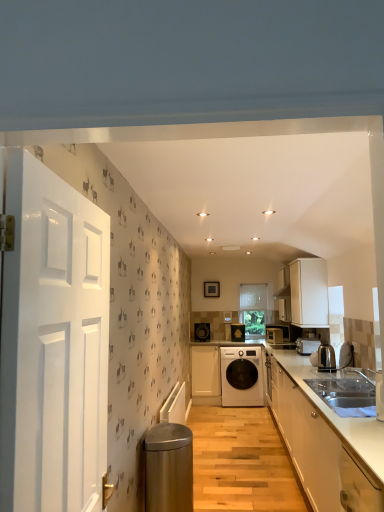
Describe the element at coordinates (347, 392) in the screenshot. The width and height of the screenshot is (384, 512). I see `stainless steel sink at lower right` at that location.

Find the location of a particular element. white glossy cabinets at lower right, which is the 2th cabinetry from right to left is located at coordinates (320, 451).

This screenshot has width=384, height=512. Describe the element at coordinates (309, 291) in the screenshot. I see `white matte cabinet at upper right, the 1th cabinetry when ordered from right to left` at that location.

Image resolution: width=384 pixels, height=512 pixels. Describe the element at coordinates (307, 345) in the screenshot. I see `metallic silver toaster at lower right, which is the second kitchen appliance from front to back` at that location.

Describe the element at coordinates (53, 343) in the screenshot. This screenshot has height=512, width=384. I see `white glossy door at left` at that location.

This screenshot has height=512, width=384. Identify the location of white matte cabinet at center, placed as the 1th cabinetry when sorted from left to right. (205, 371).

I want to click on the 3rd appliance positioned above the matte black microwave at center, marked as the third kitchen appliance in a front-to-back arrangement (from the image's perspective), so click(202, 332).

Considering the positions of objects matte black microwave at center, the first kitchen appliance from the back, and matte black speaker at center, arranged as the third appliance when viewed from the right, in the image provided, who is more to the right, matte black microwave at center, the first kitchen appliance from the back, or matte black speaker at center, arranged as the third appliance when viewed from the right,?

matte black microwave at center, the first kitchen appliance from the back, is more to the right.

Would you say matte black speaker at center, arranged as the third appliance when viewed from the right, is part of matte black microwave at center, the first kitchen appliance from the back,'s contents?

No, matte black speaker at center, arranged as the third appliance when viewed from the right, is not a part of matte black microwave at center, the first kitchen appliance from the back.

Can you tell me how much matte black microwave at center, the first kitchen appliance from the back, and matte black speaker at center, the first appliance when ordered from left to right, differ in facing direction?

matte black microwave at center, the first kitchen appliance from the back, and matte black speaker at center, the first appliance when ordered from left to right, are facing 56 degrees away from each other.

In the scene shown: Considering the relative positions of matte black speaker at center, arranged as the third appliance when viewed from the right, and white fabric at center in the image provided, is matte black speaker at center, arranged as the third appliance when viewed from the right, to the right of white fabric at center from the viewer's perspective?

Incorrect, matte black speaker at center, arranged as the third appliance when viewed from the right, is not on the right side of white fabric at center.

Considering the points (197, 327) and (258, 296), which point is behind, point (197, 327) or point (258, 296)?

The point (258, 296) is farther from the camera.

Locate an element on the screen. The image size is (384, 512). window screen behind the matte black speaker at center, arranged as the third appliance when viewed from the right is located at coordinates (253, 309).

Is point (243, 328) positioned in front of point (355, 411)?

No, it is not.

Which is more to the right, white glossy washing machine at center, the second appliance positioned from the left, or stainless steel sink at lower right?

stainless steel sink at lower right.

From a real-world perspective, is white glossy washing machine at center, arranged as the second appliance when viewed from the right, positioned above or below stainless steel sink at lower right?

white glossy washing machine at center, arranged as the second appliance when viewed from the right, is above stainless steel sink at lower right.

Considering the sizes of objects white fabric at center and stainless steel water heater at lower left in the image provided, who is bigger, white fabric at center or stainless steel water heater at lower left?

stainless steel water heater at lower left.

Which of these two, white fabric at center or stainless steel water heater at lower left, is wider?

stainless steel water heater at lower left.

From the picture: From the image's perspective, would you say white fabric at center is positioned over stainless steel water heater at lower left?

Yes, from the image's perspective, white fabric at center is above stainless steel water heater at lower left.

Considering the positions of point (265, 286) and point (192, 478), is point (265, 286) closer or farther from the camera than point (192, 478)?

Point (265, 286) is positioned farther from the camera compared to point (192, 478).

Considering the relative positions of white matte cabinet at upper right, the 1th cabinetry when ordered from right to left, and white glossy washing machine at center, arranged as the second appliance when viewed from the right, in the image provided, is white matte cabinet at upper right, the 1th cabinetry when ordered from right to left, in front of white glossy washing machine at center, arranged as the second appliance when viewed from the right,?

Yes, white matte cabinet at upper right, the 1th cabinetry when ordered from right to left, is in front of white glossy washing machine at center, arranged as the second appliance when viewed from the right.

Considering the sizes of objects white matte cabinet at upper right, marked as the 2th cabinetry in a front-to-back arrangement, and white glossy washing machine at center, the second appliance positioned from the left, in the image provided, who is bigger, white matte cabinet at upper right, marked as the 2th cabinetry in a front-to-back arrangement, or white glossy washing machine at center, the second appliance positioned from the left,?

white matte cabinet at upper right, marked as the 2th cabinetry in a front-to-back arrangement, is bigger.

From the image's perspective, which is above, white matte cabinet at upper right, arranged as the second cabinetry when viewed from the back, or white glossy washing machine at center, arranged as the second appliance when viewed from the right?

From the image's view, white matte cabinet at upper right, arranged as the second cabinetry when viewed from the back, is above.

What are the coordinates of `cabinetry above the white glossy washing machine at center, arranged as the second appliance when viewed from the right (from a real-world perspective)` in the screenshot? It's located at (309, 291).

Considering the relative sizes of white glossy washing machine at center and matte black microwave at center, marked as the third kitchen appliance in a front-to-back arrangement, in the image provided, is white glossy washing machine at center thinner than matte black microwave at center, marked as the third kitchen appliance in a front-to-back arrangement,?

Incorrect, the width of white glossy washing machine at center is not less than that of matte black microwave at center, marked as the third kitchen appliance in a front-to-back arrangement.

Where is `home appliance lying on the left of matte black microwave at center, the first kitchen appliance from the back`? The height and width of the screenshot is (512, 384). home appliance lying on the left of matte black microwave at center, the first kitchen appliance from the back is located at coordinates (242, 376).

How different are the orientations of white glossy washing machine at center and matte black microwave at center, marked as the third kitchen appliance in a front-to-back arrangement, in degrees?

43.4 degrees.

Is white glossy washing machine at center oriented away from matte black microwave at center, marked as the third kitchen appliance in a front-to-back arrangement?

white glossy washing machine at center does not have its back to matte black microwave at center, marked as the third kitchen appliance in a front-to-back arrangement.

Between white glossy cabinets at lower right, which is the 3th cabinetry in back-to-front order, and metallic silver microwave at center, which is the third appliance in left-to-right order, which one has smaller size?

metallic silver microwave at center, which is the third appliance in left-to-right order, is smaller.

Which of these two, white glossy cabinets at lower right, which is counted as the first cabinetry, starting from the front, or metallic silver microwave at center, which ranks as the first appliance in right-to-left order, stands shorter?

Standing shorter between the two is metallic silver microwave at center, which ranks as the first appliance in right-to-left order.

Where is `the 1st cabinetry below the metallic silver microwave at center, which is the third appliance in left-to-right order (from the image's perspective)`? the 1st cabinetry below the metallic silver microwave at center, which is the third appliance in left-to-right order (from the image's perspective) is located at coordinates (320, 451).

Measure the distance from white glossy cabinets at lower right, which is counted as the first cabinetry, starting from the front, to metallic silver microwave at center, which ranks as the first appliance in right-to-left order.

7.91 feet.

Starting from the matte black microwave at center, the first kitchen appliance from the back, which appliance is the 1st one behind? Please provide its 2D coordinates.

[(202, 332)]

What are the coordinates of `appliance that is the 1st one when counting downward from the white fabric at center (from the image's perspective)` in the screenshot? It's located at (202, 332).

Estimate the real-world distances between objects in this image. Which object is further from matte black microwave at center, the first kitchen appliance from the back, white fabric at center or shiny metallic kettle at right, the 3th kitchen appliance from the back?

The object further to matte black microwave at center, the first kitchen appliance from the back, is shiny metallic kettle at right, the 3th kitchen appliance from the back.

Which object lies nearer to the anchor point metallic silver microwave at center, which ranks as the first appliance in right-to-left order, metallic silver toaster at lower right, which is the 2th kitchen appliance in back-to-front order, or matte black microwave at center, the first kitchen appliance from the back?

matte black microwave at center, the first kitchen appliance from the back, lies closer to metallic silver microwave at center, which ranks as the first appliance in right-to-left order, than the other object.

Looking at the image, which one is located closer to metallic silver microwave at center, which ranks as the first appliance in right-to-left order, shiny metallic kettle at right, the 3th kitchen appliance from the back, or white glossy door at left?

Based on the image, shiny metallic kettle at right, the 3th kitchen appliance from the back, appears to be nearer to metallic silver microwave at center, which ranks as the first appliance in right-to-left order.

Estimate the real-world distances between objects in this image. Which object is closer to white matte cabinet at upper right, marked as the 2th cabinetry in a front-to-back arrangement, matte black speaker at center, arranged as the third appliance when viewed from the right, or matte black microwave at center, the first kitchen appliance from the back?

matte black microwave at center, the first kitchen appliance from the back, is closer to white matte cabinet at upper right, marked as the 2th cabinetry in a front-to-back arrangement.

Which object lies further to the anchor point white glossy washing machine at center, the second appliance positioned from the left, matte black speaker at center, the first appliance when ordered from left to right, or stainless steel sink at lower right?

stainless steel sink at lower right lies further to white glossy washing machine at center, the second appliance positioned from the left, than the other object.

Considering their positions, is metallic silver microwave at center, which ranks as the first appliance in right-to-left order, positioned closer to stainless steel water heater at lower left than white glossy washing machine at center, arranged as the second appliance when viewed from the right?

metallic silver microwave at center, which ranks as the first appliance in right-to-left order, is positioned closer to the anchor stainless steel water heater at lower left.

Considering their positions, is matte black speaker at center, the first appliance when ordered from left to right, positioned closer to white glossy washing machine at center than white matte cabinet at upper right, arranged as the second cabinetry when viewed from the back?

matte black speaker at center, the first appliance when ordered from left to right, is positioned closer to the anchor white glossy washing machine at center.

From the image, which object appears to be farther from white glossy cabinets at lower right, which is the 3th cabinetry in back-to-front order, white matte cabinet at center, marked as the third cabinetry in a right-to-left arrangement, or white matte cabinet at upper right, the 3th cabinetry viewed from the left?

white matte cabinet at center, marked as the third cabinetry in a right-to-left arrangement, is further to white glossy cabinets at lower right, which is the 3th cabinetry in back-to-front order.

Locate an element on the screen. Image resolution: width=384 pixels, height=512 pixels. sink between stainless steel water heater at lower left and shiny metallic kettle at right, the first kitchen appliance when ordered from front to back, from left to right is located at coordinates (347, 392).

Locate an element on the screen. The image size is (384, 512). water heater between white glossy cabinets at lower right, acting as the second cabinetry starting from the left, and matte black speaker at center, arranged as the third appliance when viewed from the right, from front to back is located at coordinates (169, 468).

The height and width of the screenshot is (512, 384). I want to click on cabinetry located between white glossy cabinets at lower right, acting as the second cabinetry starting from the left, and metallic silver microwave at center, which ranks as the first appliance in right-to-left order, in the depth direction, so click(x=309, y=291).

At what (x,y) coordinates should I click in order to perform the action: click on kitchen appliance between stainless steel water heater at lower left and white matte cabinet at upper right, the 3th cabinetry viewed from the left, from front to back. Please return your answer as a coordinate pair (x, y). The image size is (384, 512). Looking at the image, I should click on (326, 358).